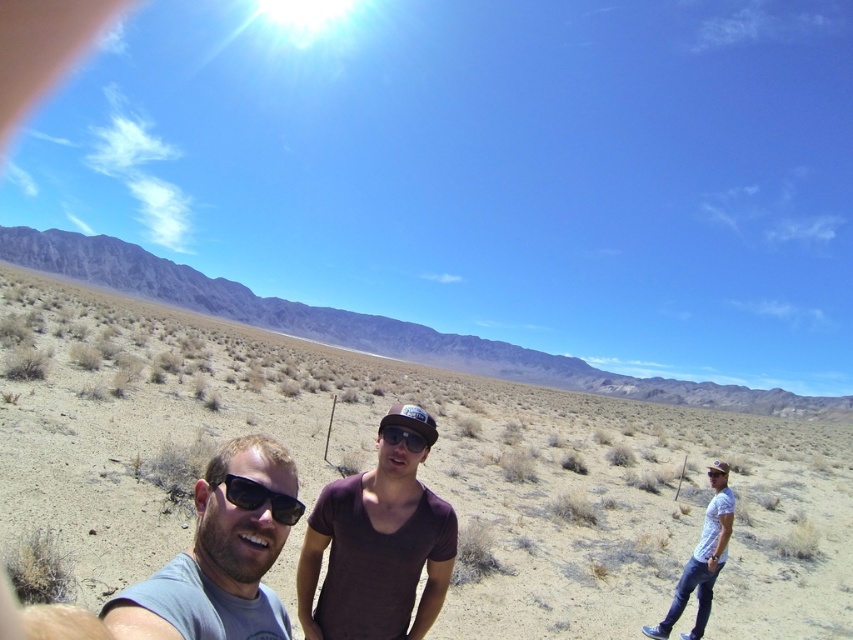
Does purple cotton shirt at center have a lesser width compared to matte black sunglasses at lower left?

In fact, purple cotton shirt at center might be wider than matte black sunglasses at lower left.

Between point (345, 616) and point (250, 488), which one is positioned behind?

Point (345, 616)

Who is more distant from viewer, (375, 552) or (282, 516)?

The point (375, 552) is more distant.

The width and height of the screenshot is (853, 640). I want to click on purple cotton shirt at center, so click(x=376, y=545).

Which of these two, gray fabric shirt at center or purple cotton shirt at center, stands shorter?

With less height is purple cotton shirt at center.

Between gray fabric shirt at center and purple cotton shirt at center, which one appears on the left side from the viewer's perspective?

From the viewer's perspective, purple cotton shirt at center appears more on the left side.

Who is more distant from viewer, (395,573) or (318,528)?

The point (318,528) is behind.

The image size is (853, 640). I want to click on gray fabric shirt at center, so click(376, 552).

Between gray fabric shirt at center and matte black goggles at center, which one is positioned higher?

matte black goggles at center is above.

Is point (395, 604) behind point (413, 449)?

Yes, it is behind point (413, 449).

Is point (437, 570) positioned before point (403, 438)?

No, (437, 570) is further to viewer.

Locate an element on the screen. The image size is (853, 640). gray fabric shirt at center is located at coordinates (376, 552).